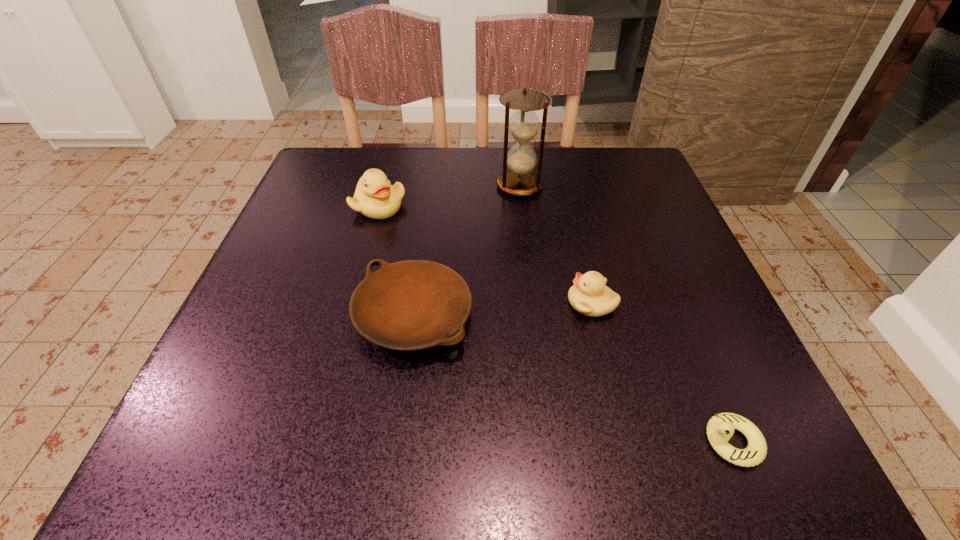
This screenshot has width=960, height=540. What are the coordinates of `the third object from left to right` in the screenshot? It's located at (524, 124).

Where is `hourglass`? hourglass is located at coordinates (524, 124).

Where is `the fourth shortest object`? This screenshot has width=960, height=540. the fourth shortest object is located at coordinates (375, 197).

You are a GUI agent. You are given a task and a screenshot of the screen. Output one action in this format:
    pyautogui.click(x=<x>, y=<y>)
    Task: Click on the tallest duckling
    This screenshot has height=540, width=960.
    Given the screenshot: What is the action you would take?
    pyautogui.click(x=375, y=197)

This screenshot has width=960, height=540. Find the location of `the second duckling from right to left`. the second duckling from right to left is located at coordinates (589, 295).

Image resolution: width=960 pixels, height=540 pixels. In order to click on the fourth object from left to right in this screenshot , I will do `click(589, 295)`.

Where is `plate`? The image size is (960, 540). plate is located at coordinates (409, 305).

Locate an element on the screen. the nearest object is located at coordinates (720, 428).

You are a GUI agent. You are given a task and a screenshot of the screen. Output one action in this format:
    pyautogui.click(x=<x>, y=<y>)
    Task: Click on the shortest duckling
    This screenshot has width=960, height=540.
    Given the screenshot: What is the action you would take?
    pyautogui.click(x=720, y=428)

You are a GUI agent. You are given a task and a screenshot of the screen. Output one action in this format:
    pyautogui.click(x=<x>, y=<y>)
    Task: Click on the vacant space situated 0.050m on the left of the hourglass
    The image size is (960, 540).
    Given the screenshot: What is the action you would take?
    pyautogui.click(x=474, y=186)